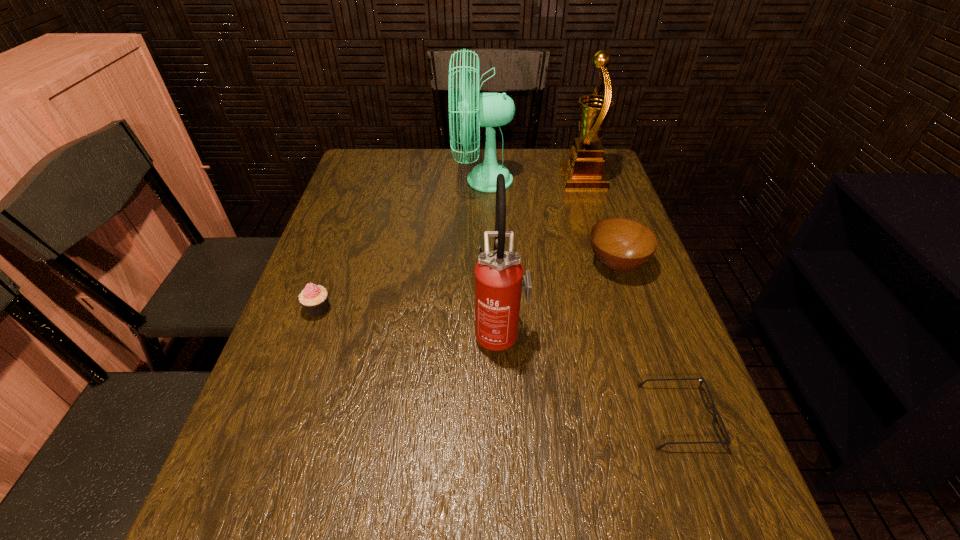
You are a GUI agent. You are given a task and a screenshot of the screen. Output one action in this format:
    pyautogui.click(x=<x>, y=<y>)
    Task: Click on the object that is positioned at the left edge
    This screenshot has width=960, height=540.
    Given the screenshot: What is the action you would take?
    314,299

Identify the location of award situated at the right edge. This screenshot has height=540, width=960. (584, 170).

Image resolution: width=960 pixels, height=540 pixels. I want to click on bowl present at the right edge, so click(x=620, y=244).

Find the location of a particular element. The image size is (960, 540). spectacles that is at the right edge is located at coordinates [701, 379].

The width and height of the screenshot is (960, 540). I want to click on object present at the far right corner, so click(584, 170).

In order to click on free space at the far edge of the desktop in this screenshot , I will do `click(534, 173)`.

The image size is (960, 540). Find the location of `blank area at the near edge`. blank area at the near edge is located at coordinates (446, 533).

Locate an element on the screen. vacant space at the left edge is located at coordinates (344, 218).

Image resolution: width=960 pixels, height=540 pixels. Identify the location of vacant space at the right edge of the desktop. (586, 209).

The width and height of the screenshot is (960, 540). I want to click on unoccupied position between the fire extinguisher and the nearest object, so click(x=589, y=374).